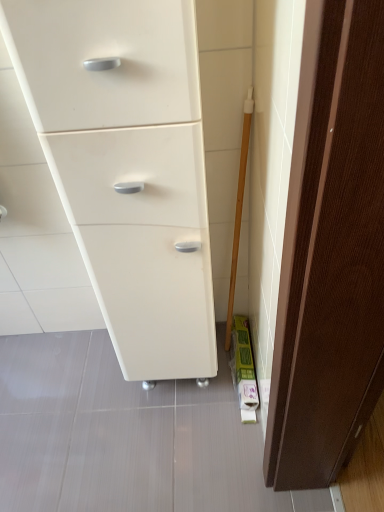
Where is `free location to the left of white plastic chest of drawers at center`? This screenshot has height=512, width=384. free location to the left of white plastic chest of drawers at center is located at coordinates (91, 390).